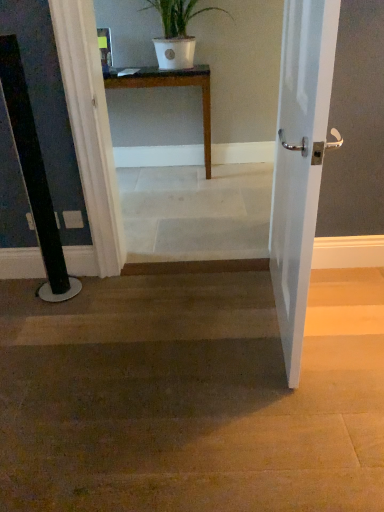
Question: Can you confirm if white matte pot at upper center is positioned to the right of white marble stairs at center?

Choices:
 (A) no
 (B) yes

Answer: (A)

Question: Is white matte pot at upper center facing towards white marble stairs at center?

Choices:
 (A) no
 (B) yes

Answer: (B)

Question: From the image's perspective, would you say white matte pot at upper center is shown under white marble stairs at center?

Choices:
 (A) no
 (B) yes

Answer: (A)

Question: Considering the relative sizes of white matte pot at upper center and white marble stairs at center in the image provided, is white matte pot at upper center shorter than white marble stairs at center?

Choices:
 (A) yes
 (B) no

Answer: (A)

Question: From a real-world perspective, is white matte pot at upper center positioned under white marble stairs at center based on gravity?

Choices:
 (A) yes
 (B) no

Answer: (B)

Question: Is white matte pot at upper center inside or outside of white glossy door at right?

Choices:
 (A) outside
 (B) inside

Answer: (A)

Question: Is white matte pot at upper center in front of or behind white glossy door at right in the image?

Choices:
 (A) front
 (B) behind

Answer: (B)

Question: Is point (175, 7) closer or farther from the camera than point (327, 58)?

Choices:
 (A) farther
 (B) closer

Answer: (A)

Question: Considering the relative positions of white matte pot at upper center and white glossy door at right in the image provided, is white matte pot at upper center to the left or to the right of white glossy door at right?

Choices:
 (A) left
 (B) right

Answer: (A)

Question: Is white glossy door at right in front of or behind brown wood floor at center in the image?

Choices:
 (A) front
 (B) behind

Answer: (A)

Question: From the image's perspective, relative to brown wood floor at center, is white glossy door at right above or below?

Choices:
 (A) above
 (B) below

Answer: (A)

Question: Is white glossy door at right wider or thinner than brown wood floor at center?

Choices:
 (A) wide
 (B) thin

Answer: (B)

Question: Considering the positions of point (284, 169) and point (230, 452), is point (284, 169) closer or farther from the camera than point (230, 452)?

Choices:
 (A) farther
 (B) closer

Answer: (A)

Question: Does point (190, 72) appear closer or farther from the camera than point (299, 90)?

Choices:
 (A) closer
 (B) farther

Answer: (B)

Question: From the image's perspective, is wooden table at center positioned above or below white glossy door at right?

Choices:
 (A) above
 (B) below

Answer: (A)